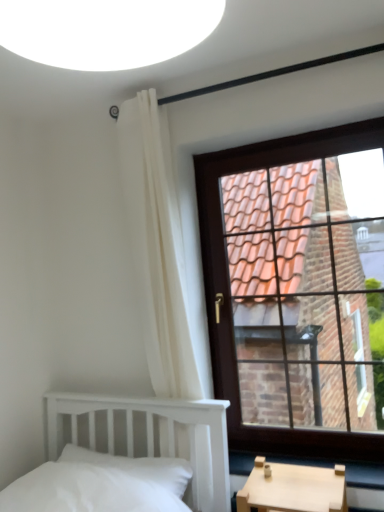
Question: Considering the relative sizes of brown wooden window at upper right and white fabric curtain at upper left in the image provided, is brown wooden window at upper right taller than white fabric curtain at upper left?

Choices:
 (A) yes
 (B) no

Answer: (B)

Question: From a real-world perspective, does brown wooden window at upper right sit lower than white fabric curtain at upper left?

Choices:
 (A) no
 (B) yes

Answer: (B)

Question: Is brown wooden window at upper right turned away from white fabric curtain at upper left?

Choices:
 (A) no
 (B) yes

Answer: (A)

Question: Considering the relative positions of brown wooden window at upper right and white fabric curtain at upper left in the image provided, is brown wooden window at upper right to the left of white fabric curtain at upper left from the viewer's perspective?

Choices:
 (A) no
 (B) yes

Answer: (A)

Question: From the image's perspective, does brown wooden window at upper right appear lower than white fabric curtain at upper left?

Choices:
 (A) no
 (B) yes

Answer: (A)

Question: Looking at the image, does white fabric curtain at upper left seem bigger or smaller compared to white soft pillow at lower left?

Choices:
 (A) small
 (B) big

Answer: (B)

Question: Is point (165, 125) closer or farther from the camera than point (178, 465)?

Choices:
 (A) farther
 (B) closer

Answer: (A)

Question: Visually, is white fabric curtain at upper left positioned to the left or to the right of white soft pillow at lower left?

Choices:
 (A) left
 (B) right

Answer: (B)

Question: Considering their positions, is white fabric curtain at upper left located in front of or behind white soft pillow at lower left?

Choices:
 (A) behind
 (B) front

Answer: (A)

Question: Is white soft pillow at lower left taller or shorter than white fabric curtain at upper left?

Choices:
 (A) tall
 (B) short

Answer: (B)

Question: Visually, is white soft pillow at lower left positioned to the left or to the right of white fabric curtain at upper left?

Choices:
 (A) right
 (B) left

Answer: (B)

Question: Considering the positions of white soft pillow at lower left and white fabric curtain at upper left in the image, is white soft pillow at lower left wider or thinner than white fabric curtain at upper left?

Choices:
 (A) thin
 (B) wide

Answer: (B)

Question: In the image, is white soft pillow at lower left positioned in front of or behind white fabric curtain at upper left?

Choices:
 (A) front
 (B) behind

Answer: (A)

Question: Is point (342, 303) closer or farther from the camera than point (167, 480)?

Choices:
 (A) farther
 (B) closer

Answer: (A)

Question: Do you think brown wooden window at upper right is within white soft pillow at lower left, or outside of it?

Choices:
 (A) outside
 (B) inside

Answer: (A)